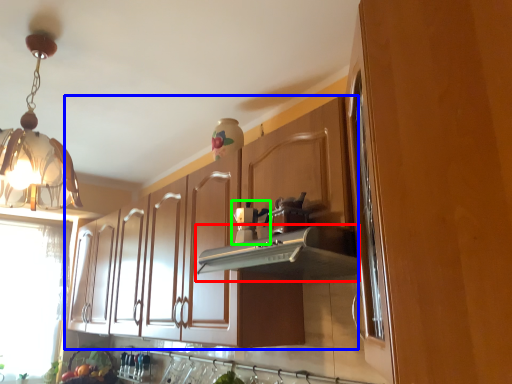
Question: Which is nearer to the vent (highlighted by a red box)? cabinetry (highlighted by a blue box) or coffee machine (highlighted by a green box).

Choices:
 (A) cabinetry
 (B) coffee machine

Answer: (B)